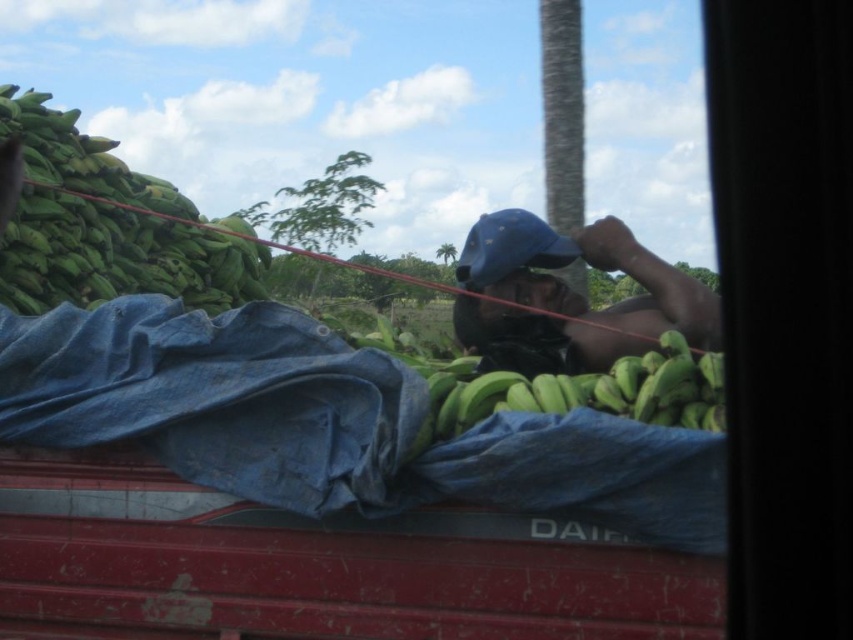
Question: Which point is farther from the camera taking this photo?

Choices:
 (A) (21, 291)
 (B) (473, 280)
 (C) (461, 378)

Answer: (A)

Question: Is green matte bananas at upper left smaller than blue fabric cap at center?

Choices:
 (A) no
 (B) yes

Answer: (A)

Question: Among these points, which one is nearest to the camera?

Choices:
 (A) (48, 292)
 (B) (596, 220)

Answer: (B)

Question: Among these points, which one is farthest from the camera?

Choices:
 (A) (677, 356)
 (B) (618, 320)
 (C) (202, 294)

Answer: (C)

Question: Can you confirm if green matte bananas at upper left is positioned below green matte bananas at center?

Choices:
 (A) no
 (B) yes

Answer: (A)

Question: Is green matte bananas at upper left smaller than blue fabric cap at center?

Choices:
 (A) yes
 (B) no

Answer: (B)